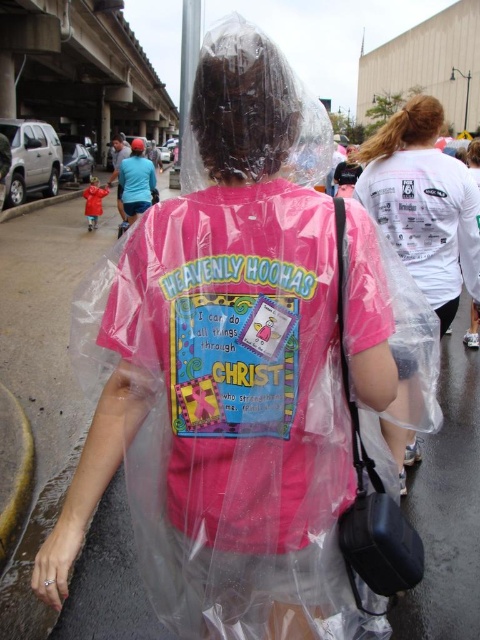
Question: Does transparent plastic bag at right have a smaller size compared to black synthetic bag at right?

Choices:
 (A) no
 (B) yes

Answer: (A)

Question: Which point is farther to the camera?

Choices:
 (A) transparent plastic bag at right
 (B) black synthetic bag at right

Answer: (A)

Question: Can you confirm if transparent plastic bag at right is positioned above black synthetic bag at right?

Choices:
 (A) yes
 (B) no

Answer: (A)

Question: Does transparent plastic bag at right have a smaller size compared to black synthetic bag at right?

Choices:
 (A) no
 (B) yes

Answer: (A)

Question: Which object is closer to the camera taking this photo?

Choices:
 (A) transparent plastic bag at right
 (B) black synthetic bag at right

Answer: (B)